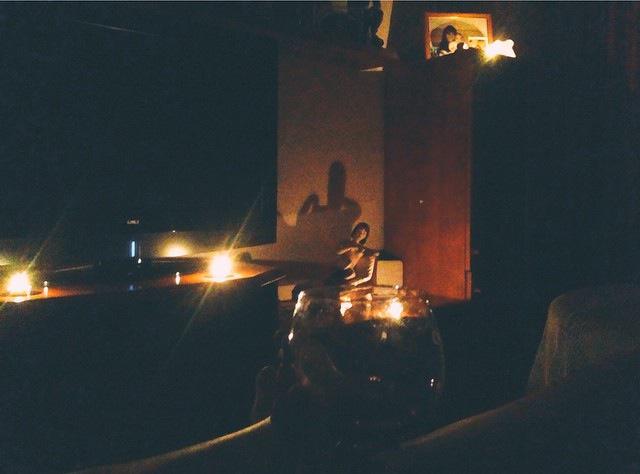
Locate an element on the screen. This screenshot has width=640, height=474. tra candle rt is located at coordinates (399, 306).